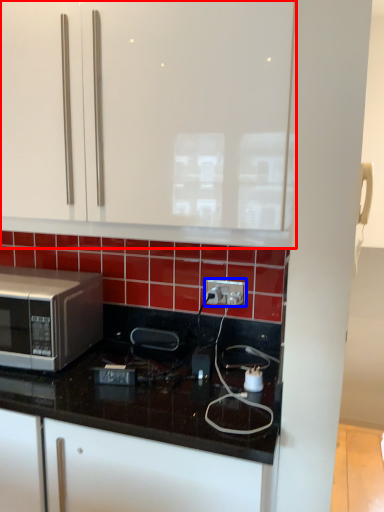
Question: Among these objects, which one is farthest to the camera, cabinetry (highlighted by a red box) or electric outlet (highlighted by a blue box)?

Choices:
 (A) cabinetry
 (B) electric outlet

Answer: (B)